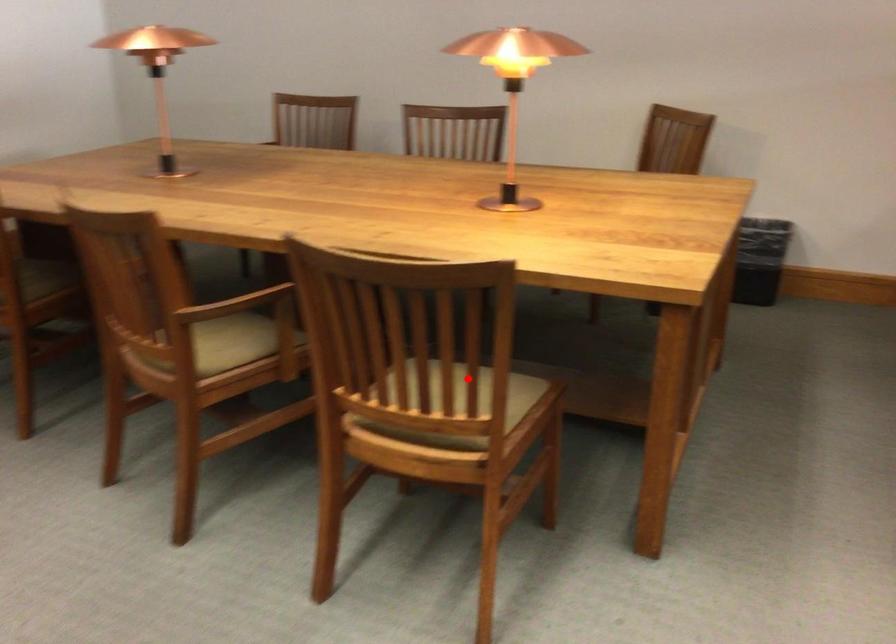
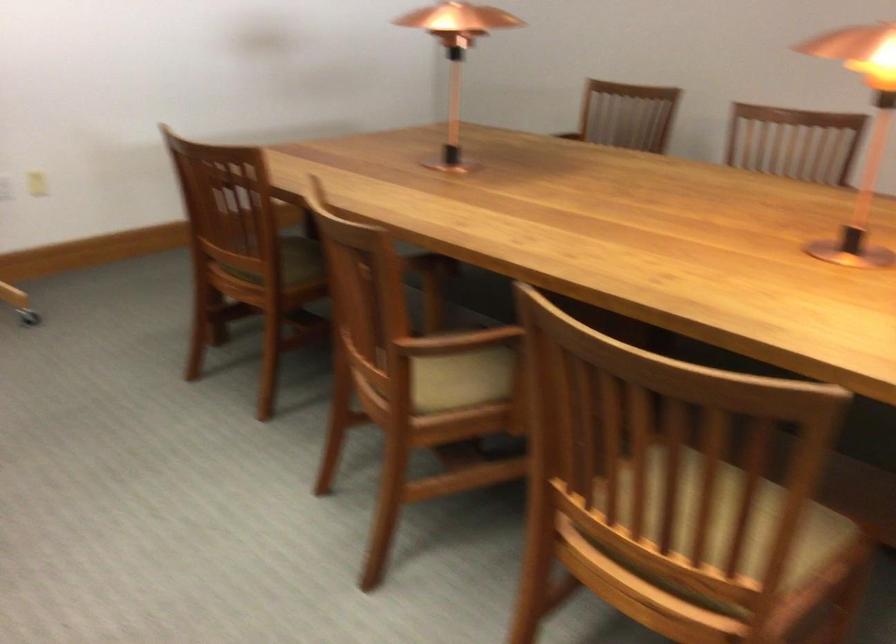
Where in the second image is the point corresponding to the highlighted location from the first image?

(728, 526)